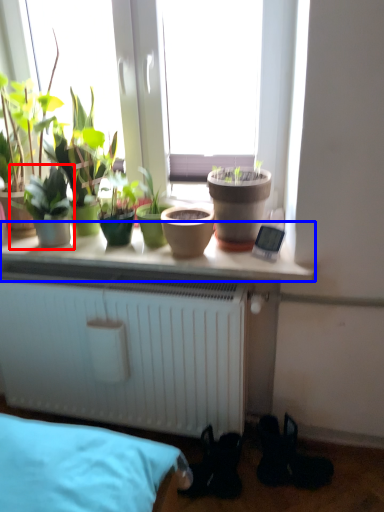
Question: Which point is closer to the camera, houseplant (highlighted by a red box) or window sill (highlighted by a blue box)?

Choices:
 (A) houseplant
 (B) window sill

Answer: (B)